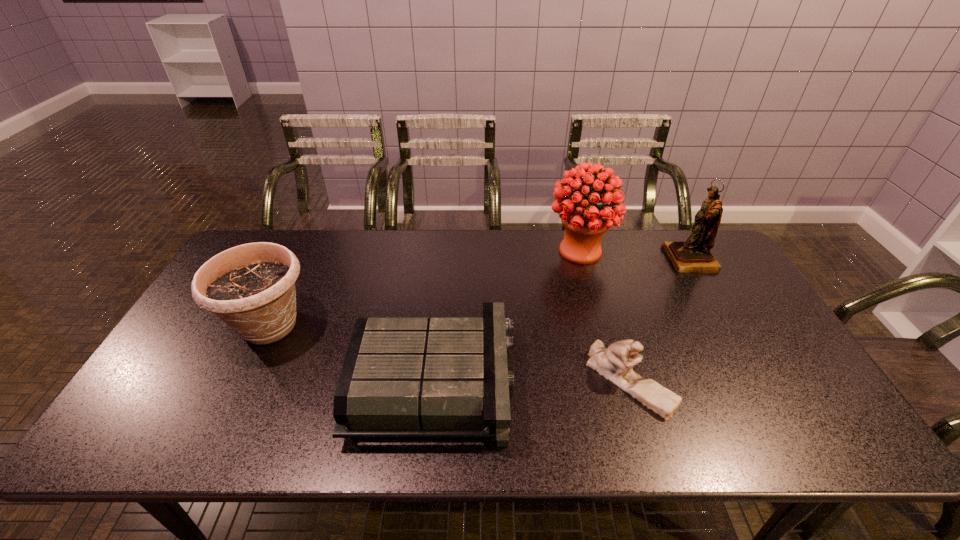
You are a GUI agent. You are given a task and a screenshot of the screen. Output one action in this format:
    pyautogui.click(x=<x>, y=<y>)
    Task: Click on the object located in the right edge section of the desktop
    This screenshot has height=540, width=960.
    Given the screenshot: What is the action you would take?
    pyautogui.click(x=693, y=255)

Locate an element on the screen. object at the far right corner is located at coordinates (693, 255).

Where is `free space at the far edge`? free space at the far edge is located at coordinates (372, 273).

The width and height of the screenshot is (960, 540). In order to click on blank area at the near edge in this screenshot , I will do `click(432, 443)`.

This screenshot has height=540, width=960. Find the location of `blank space at the left edge`. blank space at the left edge is located at coordinates (164, 407).

At what (x,y) coordinates should I click in order to perform the action: click on blank space at the right edge of the desktop. Please return your answer as a coordinate pair (x, y). The image size is (960, 540). Looking at the image, I should click on (794, 395).

The height and width of the screenshot is (540, 960). Find the location of `free region at the near left corner of the desktop`. free region at the near left corner of the desktop is located at coordinates (165, 434).

In order to click on free spot between the flowerpot and the right figurine in this screenshot , I will do point(480,293).

Find the location of `empty location between the rightmost object and the third tallest object`. empty location between the rightmost object and the third tallest object is located at coordinates (480, 293).

You are a GUI agent. You are given a task and a screenshot of the screen. Output one action in this format:
    pyautogui.click(x=<x>, y=<y>)
    Task: Click on the free space between the right figurine and the third tallest object
    Image resolution: width=960 pixels, height=540 pixels.
    Given the screenshot: What is the action you would take?
    pyautogui.click(x=480, y=293)